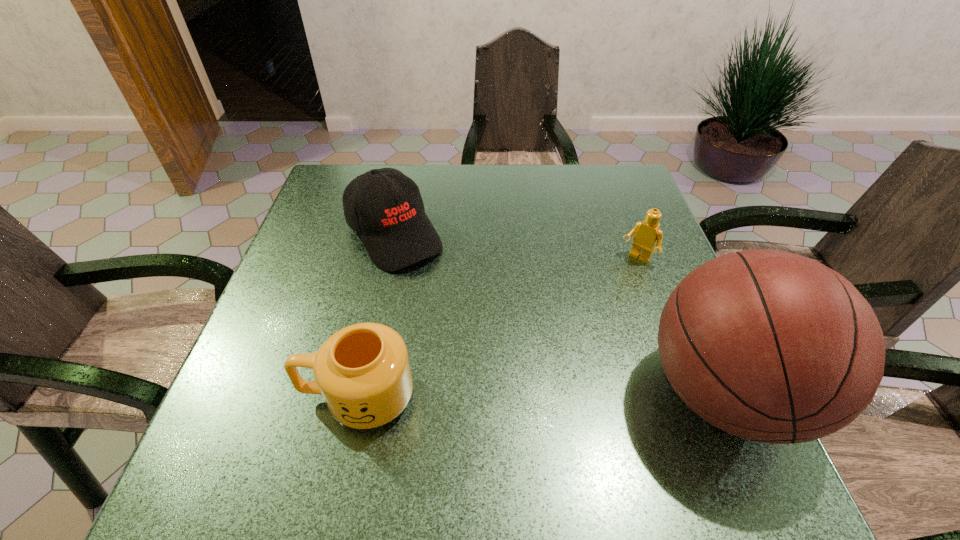
Identify the location of free spot located on the front-facing side of the baseball cap. (487, 354).

This screenshot has width=960, height=540. Find the location of `free space located on the front-facing side of the baseball cap`. free space located on the front-facing side of the baseball cap is located at coordinates 484,351.

Find the location of a particular element. The width and height of the screenshot is (960, 540). vacant space located 0.390m on the front-facing side of the baseball cap is located at coordinates (514, 388).

At what (x,y) coordinates should I click in order to perform the action: click on object that is positioned at the far edge. Please return your answer as a coordinate pair (x, y). Image resolution: width=960 pixels, height=540 pixels. Looking at the image, I should click on (384, 206).

At what (x,y) coordinates should I click in order to perform the action: click on mug that is at the near edge. Please return your answer as a coordinate pair (x, y). Looking at the image, I should click on (363, 371).

You are a GUI agent. You are given a task and a screenshot of the screen. Output one action in this format:
    pyautogui.click(x=<x>, y=<y>)
    Task: Click on the basketball that is at the near edge
    This screenshot has height=540, width=960.
    Given the screenshot: What is the action you would take?
    pyautogui.click(x=770, y=346)

This screenshot has width=960, height=540. In order to click on mug located in the left edge section of the desktop in this screenshot , I will do `click(363, 371)`.

Where is `baseball cap present at the left edge`? The height and width of the screenshot is (540, 960). baseball cap present at the left edge is located at coordinates (384, 206).

Image resolution: width=960 pixels, height=540 pixels. In order to click on basketball situated at the right edge in this screenshot , I will do 770,346.

This screenshot has width=960, height=540. Find the location of `Lego that is at the right edge`. Lego that is at the right edge is located at coordinates (648, 233).